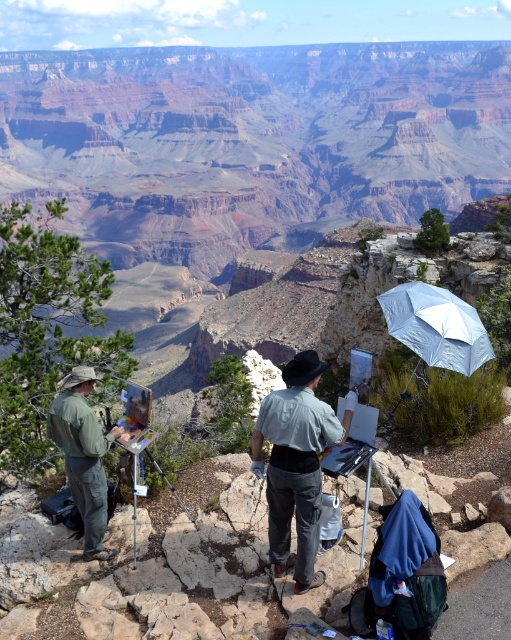
Question: Does light blue denim shirt at center appear under silver reflective umbrella at upper right?

Choices:
 (A) no
 (B) yes

Answer: (B)

Question: Can you confirm if green matte uniform at center is positioned to the right of silver reflective umbrella at upper right?

Choices:
 (A) yes
 (B) no

Answer: (B)

Question: Which object appears closest to the camera in this image?

Choices:
 (A) green matte uniform at center
 (B) light blue denim shirt at center

Answer: (B)

Question: Among these objects, which one is farthest from the camera?

Choices:
 (A) silver reflective umbrella at upper right
 (B) green matte uniform at center

Answer: (A)

Question: Can you confirm if light blue denim shirt at center is positioned above silver reflective umbrella at upper right?

Choices:
 (A) no
 (B) yes

Answer: (A)

Question: Estimate the real-world distances between objects in this image. Which object is farther from the silver reflective umbrella at upper right?

Choices:
 (A) green matte uniform at center
 (B) light blue denim shirt at center

Answer: (A)